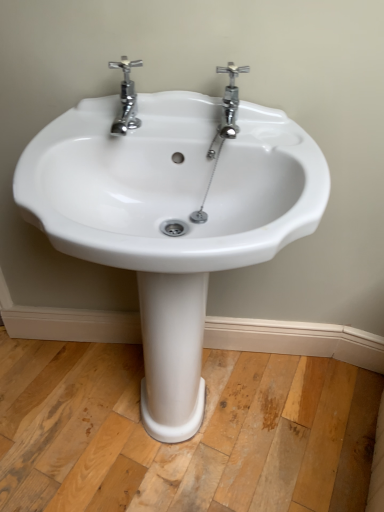
This screenshot has width=384, height=512. I want to click on free location to the left of white ceramic sink at center, so click(x=44, y=403).